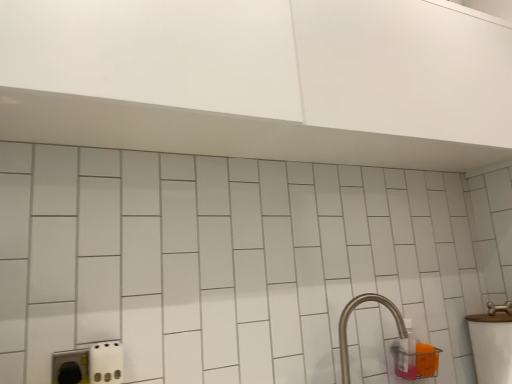
Question: Can you confirm if white glossy sink at right is taller than translucent plastic bottle at lower right?

Choices:
 (A) no
 (B) yes

Answer: (B)

Question: Can you confirm if white glossy sink at right is smaller than translucent plastic bottle at lower right?

Choices:
 (A) no
 (B) yes

Answer: (A)

Question: From a real-world perspective, is white glossy sink at right on translucent plastic bottle at lower right?

Choices:
 (A) yes
 (B) no

Answer: (B)

Question: Considering the relative sizes of white glossy sink at right and translucent plastic bottle at lower right in the image provided, is white glossy sink at right bigger than translucent plastic bottle at lower right?

Choices:
 (A) no
 (B) yes

Answer: (B)

Question: Considering the relative sizes of white glossy sink at right and translucent plastic bottle at lower right in the image provided, is white glossy sink at right thinner than translucent plastic bottle at lower right?

Choices:
 (A) no
 (B) yes

Answer: (A)

Question: Considering the positions of translucent plastic bottle at lower right and white glossy sink at right in the image, is translucent plastic bottle at lower right taller or shorter than white glossy sink at right?

Choices:
 (A) tall
 (B) short

Answer: (B)

Question: Is point (403, 322) positioned closer to the camera than point (499, 345)?

Choices:
 (A) farther
 (B) closer

Answer: (A)

Question: Is translucent plastic bottle at lower right bigger or smaller than white glossy sink at right?

Choices:
 (A) small
 (B) big

Answer: (A)

Question: Is translucent plastic bottle at lower right situated inside white glossy sink at right or outside?

Choices:
 (A) outside
 (B) inside

Answer: (A)

Question: In the image, is white glossy sink at right positioned in front of or behind translucent plastic bottle at lower right?

Choices:
 (A) front
 (B) behind

Answer: (A)

Question: Is white glossy sink at right taller or shorter than translucent plastic bottle at lower right?

Choices:
 (A) tall
 (B) short

Answer: (A)

Question: Is point (479, 362) closer or farther from the camera than point (400, 339)?

Choices:
 (A) farther
 (B) closer

Answer: (A)

Question: From a real-world perspective, is white glossy sink at right physically located above or below translucent plastic bottle at lower right?

Choices:
 (A) above
 (B) below

Answer: (B)

Question: Considering the positions of point (408, 322) and point (372, 296), is point (408, 322) closer or farther from the camera than point (372, 296)?

Choices:
 (A) farther
 (B) closer

Answer: (A)

Question: From the image's perspective, is translucent plastic bottle at lower right above or below satin nickel faucet at lower right?

Choices:
 (A) below
 (B) above

Answer: (A)